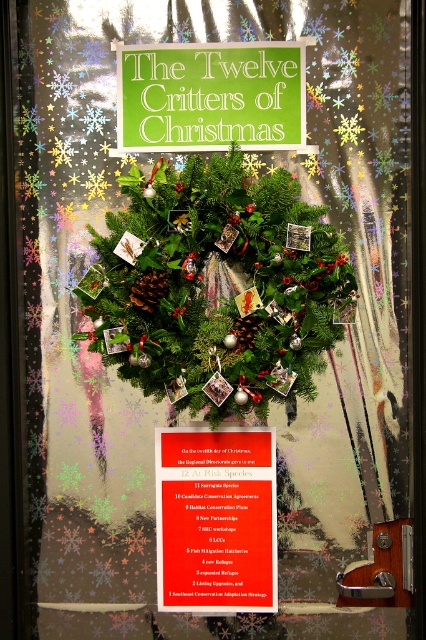
Question: Does matte red poster at center appear over brown textured pine cone at center?

Choices:
 (A) no
 (B) yes

Answer: (A)

Question: Among these points, which one is farthest from the camera?

Choices:
 (A) (271, 525)
 (B) (219, 177)
 (C) (155, 285)
 (D) (141, 125)

Answer: (A)

Question: Is matte red poster at center thinner than green paper sign at upper center?

Choices:
 (A) no
 (B) yes

Answer: (B)

Question: Which point is closer to the camera?

Choices:
 (A) (244, 328)
 (B) (146, 305)
 (C) (193, 467)

Answer: (B)

Question: Which point is closer to the camera taking this photo?

Choices:
 (A) (249, 333)
 (B) (227, 77)
 (C) (219, 568)

Answer: (B)

Question: Does matte red poster at center have a lesser width compared to green paper sign at upper center?

Choices:
 (A) no
 (B) yes

Answer: (B)